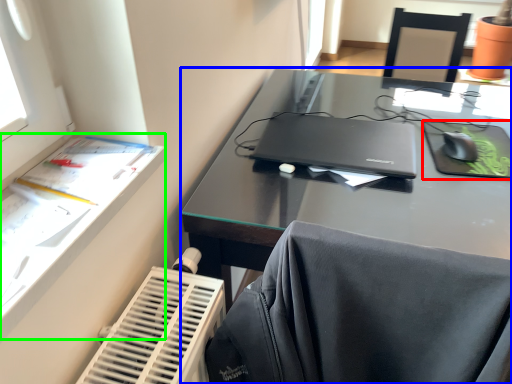
Question: Which is farther away from tablet computer (highlighted by a red box)? desk (highlighted by a blue box) or writing desk (highlighted by a green box)?

Choices:
 (A) desk
 (B) writing desk

Answer: (B)